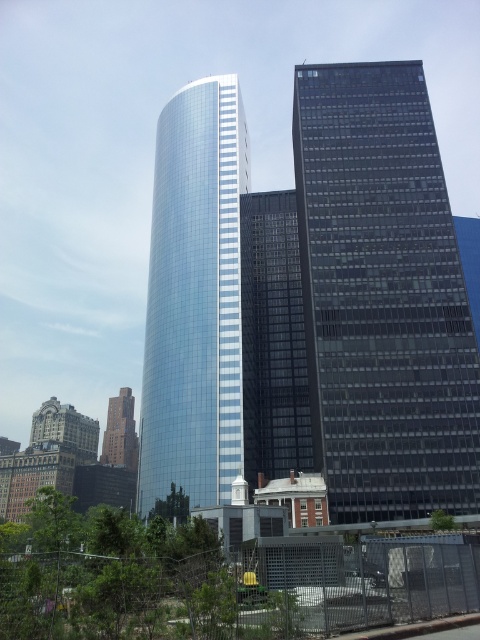
Question: Does dark glass skyscraper at right appear over brick building at lower left?

Choices:
 (A) yes
 (B) no

Answer: (A)

Question: Can you confirm if dark glass skyscraper at right is thinner than brick building at lower left?

Choices:
 (A) yes
 (B) no

Answer: (A)

Question: Which is nearer to the dark glass skyscraper at right?

Choices:
 (A) glossy glass tower at center
 (B) brick building at lower left

Answer: (A)

Question: Which point is closer to the camera taking this photo?

Choices:
 (A) (327, 481)
 (B) (227, 108)
 (C) (136, 460)

Answer: (A)

Question: Which of the following is the closest to the observer?

Choices:
 (A) brick building at lower left
 (B) dark glass skyscraper at right

Answer: (B)

Question: Can you confirm if glossy glass tower at center is positioned above brick building at lower left?

Choices:
 (A) no
 (B) yes

Answer: (B)